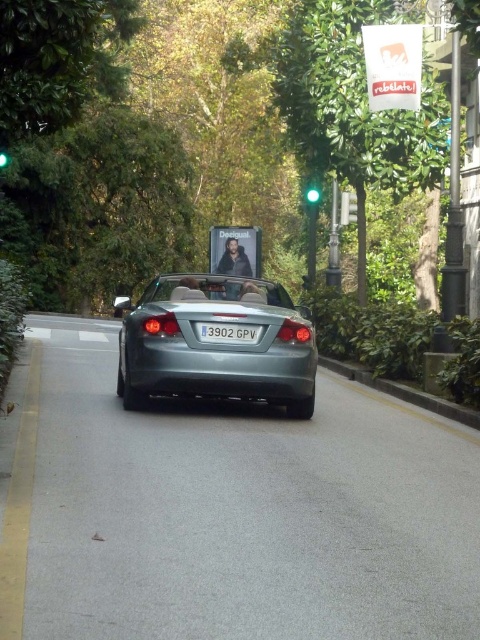
Which is in front, point (196, 275) or point (238, 332)?

Positioned in front is point (238, 332).

Is satin silver convertible at center to the left of white plastic license plate at center from the viewer's perspective?

Yes, satin silver convertible at center is to the left of white plastic license plate at center.

Who is more distant from viewer, (269, 353) or (203, 333)?

Point (269, 353)

Where is `satin silver convertible at center`? Image resolution: width=480 pixels, height=640 pixels. satin silver convertible at center is located at coordinates (216, 342).

Can you confirm if satin silver convertible at center is smaller than green glass traffic light at center?

Incorrect, satin silver convertible at center is not smaller in size than green glass traffic light at center.

Between satin silver convertible at center and green glass traffic light at center, which one is positioned higher?

green glass traffic light at center is higher up.

I want to click on satin silver convertible at center, so click(216, 342).

Is the position of green glass traffic light at upper center less distant than that of green glass traffic light at center?

No, green glass traffic light at upper center is behind green glass traffic light at center.

Which is behind, point (340, 220) or point (314, 189)?

The point (314, 189) is behind.

Find the location of a particular element. green glass traffic light at upper center is located at coordinates (348, 209).